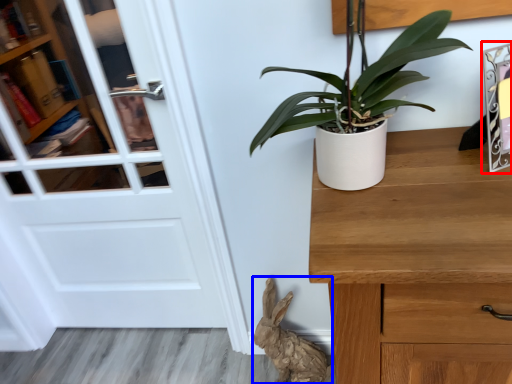
Question: Which object appears farthest to the camera in this image, picture frame (highlighted by a red box) or animal (highlighted by a blue box)?

Choices:
 (A) picture frame
 (B) animal

Answer: (B)